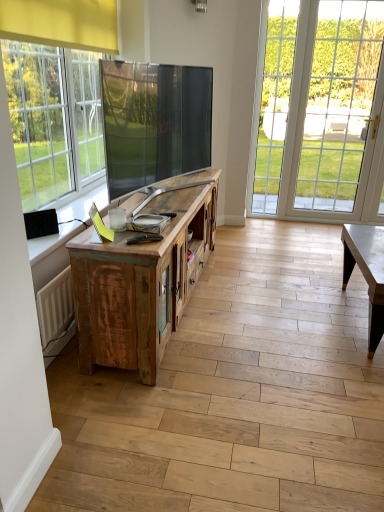
Locate an element on the screen. The width and height of the screenshot is (384, 512). free space in front of weathered wood cabinet at center is located at coordinates (213, 392).